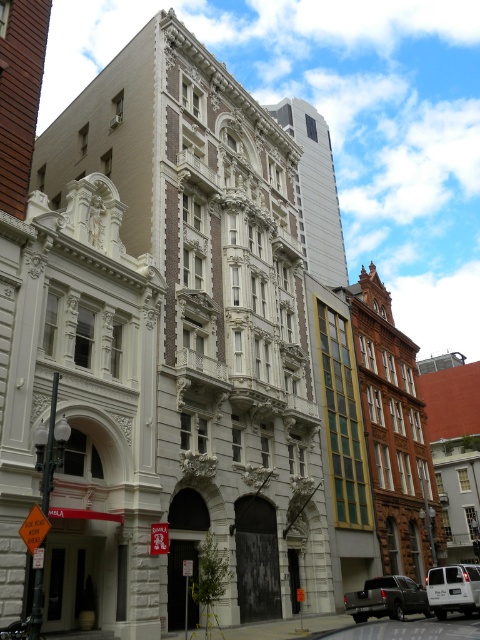
Based on the photo, you are a pedestrian standing on the sidewalk observing the street scene. There is a metallic gray truck at center and a white matte van at center. Which vehicle is closer to you?

The metallic gray truck at center is closer to you because it is positioned further to the viewer than the white matte van at center.

You are a pedestrian trying to cross the street in front of the central classical building. You see a metallic gray truck at center and a white matte van at center. Which vehicle is closer to you?

The metallic gray truck at center is located above the white matte van at center, so the white matte van at center is closer to you.